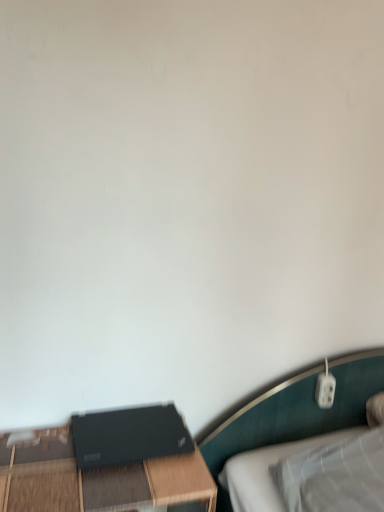
What are the coordinates of `black matte laptop at lower left` in the screenshot? It's located at (129, 436).

Describe the element at coordinates (129, 436) in the screenshot. I see `black matte laptop at lower left` at that location.

Locate an element on the screen. The width and height of the screenshot is (384, 512). black matte table at lower left is located at coordinates (96, 480).

The width and height of the screenshot is (384, 512). Describe the element at coordinates (96, 480) in the screenshot. I see `black matte table at lower left` at that location.

At what (x,y) coordinates should I click in order to perform the action: click on black matte laptop at lower left. Please return your answer as a coordinate pair (x, y). The width and height of the screenshot is (384, 512). Looking at the image, I should click on (129, 436).

In the image, is black matte table at lower left on the left side or the right side of black matte laptop at lower left?

black matte table at lower left is positioned on black matte laptop at lower left's left side.

Who is more distant, black matte table at lower left or black matte laptop at lower left?

black matte laptop at lower left is more distant.

Which is closer, (31,471) or (127,443)?

Point (31,471) appears to be closer to the viewer than point (127,443).

Consider the image. From the image's perspective, which is above, black matte table at lower left or black matte laptop at lower left?

black matte laptop at lower left, from the image's perspective.

From a real-world perspective, who is located lower, black matte table at lower left or black matte laptop at lower left?

From a 3D spatial view, black matte table at lower left is below.

In terms of width, does black matte table at lower left look wider or thinner when compared to black matte laptop at lower left?

In the image, black matte table at lower left appears to be wider than black matte laptop at lower left.

Between black matte table at lower left and black matte laptop at lower left, which one has more height?

Standing taller between the two is black matte table at lower left.

Is black matte table at lower left smaller than black matte laptop at lower left?

No, black matte table at lower left is not smaller than black matte laptop at lower left.

Choose the correct answer: Is black matte table at lower left inside black matte laptop at lower left or outside it?

black matte table at lower left is not enclosed by black matte laptop at lower left.

Are black matte table at lower left and black matte laptop at lower left beside each other?

Yes, black matte table at lower left is next to black matte laptop at lower left.

Does black matte table at lower left turn towards black matte laptop at lower left?

No, black matte table at lower left is not turned towards black matte laptop at lower left.

Measure the distance from black matte table at lower left to black matte laptop at lower left.

black matte table at lower left and black matte laptop at lower left are 3.40 inches apart.

The image size is (384, 512). There is a black matte table at lower left. Find the location of `computer above it (from a real-world perspective)`. computer above it (from a real-world perspective) is located at coordinates (129, 436).

In the image, is black matte laptop at lower left on the left side or the right side of black matte table at lower left?

Clearly, black matte laptop at lower left is on the right of black matte table at lower left in the image.

Considering the relative positions of black matte laptop at lower left and black matte table at lower left in the image provided, is black matte laptop at lower left behind black matte table at lower left?

That is True.

Which is closer to the camera, (180, 450) or (130, 482)?

Positioned in front is point (130, 482).

From the image's perspective, is black matte laptop at lower left over black matte table at lower left?

Answer: Yes.

From a real-world perspective, between black matte laptop at lower left and black matte table at lower left, who is vertically lower?

In real-world perspective, black matte table at lower left is lower.

Which of these two, black matte laptop at lower left or black matte table at lower left, is thinner?

With smaller width is black matte laptop at lower left.

Based on the photo, from their relative heights in the image, would you say black matte laptop at lower left is taller or shorter than black matte table at lower left?

In the image, black matte laptop at lower left appears to be shorter than black matte table at lower left.

In terms of size, does black matte laptop at lower left appear bigger or smaller than black matte table at lower left?

Considering their sizes, black matte laptop at lower left takes up less space than black matte table at lower left.

Is black matte laptop at lower left not inside black matte table at lower left?

Yes, black matte laptop at lower left is outside of black matte table at lower left.

Is black matte laptop at lower left far from black matte table at lower left?

No, black matte laptop at lower left is in close proximity to black matte table at lower left.

Is black matte laptop at lower left positioned with its back to black matte table at lower left?

black matte laptop at lower left is not turned away from black matte table at lower left.

In order to click on computer above the black matte table at lower left (from a real-world perspective) in this screenshot , I will do `click(129, 436)`.

Where is `computer located above the black matte table at lower left (from a real-world perspective)`? This screenshot has height=512, width=384. computer located above the black matte table at lower left (from a real-world perspective) is located at coordinates (129, 436).

You are a GUI agent. You are given a task and a screenshot of the screen. Output one action in this format:
    pyautogui.click(x=<x>, y=<y>)
    Task: Click on the table in front of the black matte laptop at lower left
    The height and width of the screenshot is (512, 384).
    Given the screenshot: What is the action you would take?
    pyautogui.click(x=96, y=480)